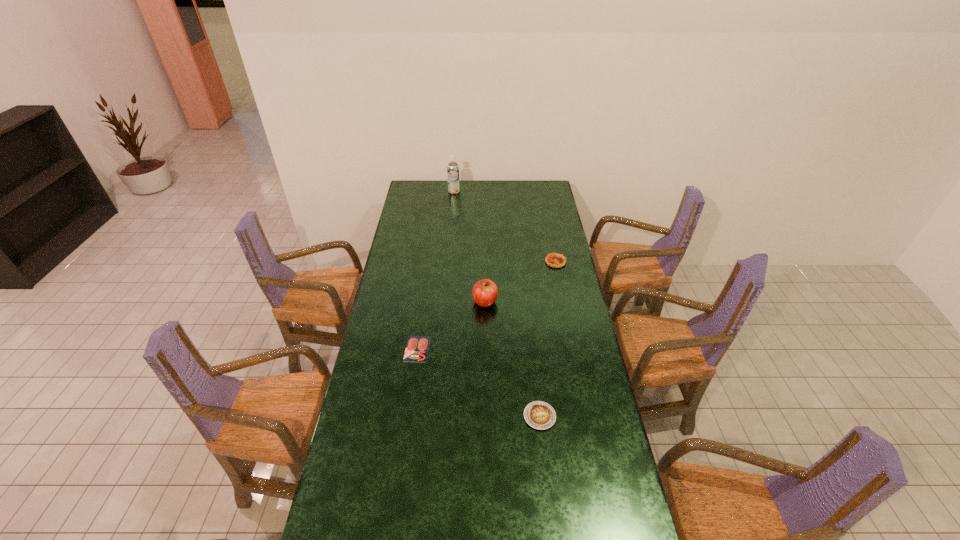
Where is `soya milk`? This screenshot has width=960, height=540. soya milk is located at coordinates (453, 176).

Where is `the fourth object from right to left`? The image size is (960, 540). the fourth object from right to left is located at coordinates (453, 176).

Where is `apple`? apple is located at coordinates (484, 292).

Where is `the third object from right to left`? the third object from right to left is located at coordinates (484, 292).

I want to click on the fourth nearest object, so click(555, 260).

Find the location of a particular element. This screenshot has height=540, width=960. the right quiche is located at coordinates (555, 260).

Find the location of a particular element. the nearest object is located at coordinates (540, 415).

I want to click on the nearer quiche, so click(540, 415).

The width and height of the screenshot is (960, 540). In order to click on the shortest object in this screenshot , I will do `click(417, 347)`.

At what (x,y) coordinates should I click in order to perform the action: click on salami. Please return your answer as a coordinate pair (x, y). This screenshot has height=540, width=960. Looking at the image, I should click on (417, 347).